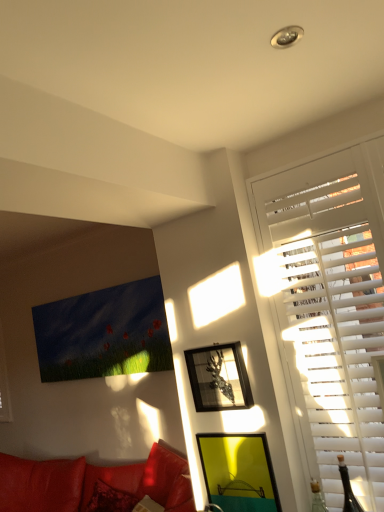
The image size is (384, 512). I want to click on yellow matte picture frame at lower center, the second picture frame when ordered from top to bottom, so click(238, 472).

Image resolution: width=384 pixels, height=512 pixels. What do you see at coordinates (92, 482) in the screenshot? I see `leather couch at lower left` at bounding box center [92, 482].

In order to face leather couch at lower left, should I rotate leftwards or rightwards?

To face it directly, rotate left by 14.970 degrees.

What is the approximate height of white wood blinds at right?

The height of white wood blinds at right is 4.57 feet.

The height and width of the screenshot is (512, 384). What do you see at coordinates (218, 378) in the screenshot?
I see `metallic silver picture frame at upper right, the first picture frame viewed from the top` at bounding box center [218, 378].

What are the coordinates of `yellow matte picture frame at lower center, the first picture frame from the bottom` in the screenshot? It's located at (238, 472).

Considering the relative positions of metallic silver picture frame at upper right, the first picture frame viewed from the top, and leather couch at lower left in the image provided, is metallic silver picture frame at upper right, the first picture frame viewed from the top, to the right of leather couch at lower left from the viewer's perspective?

Yes.

Is leather couch at lower left located within metallic silver picture frame at upper right, which is counted as the second picture frame, starting from the bottom?

No, leather couch at lower left is not a part of metallic silver picture frame at upper right, which is counted as the second picture frame, starting from the bottom.

Which is behind, metallic silver picture frame at upper right, which is counted as the second picture frame, starting from the bottom, or leather couch at lower left?

leather couch at lower left.

Is point (239, 351) closer or farther from the camera than point (209, 479)?

Point (239, 351).

Is metallic silver picture frame at upper right, the first picture frame viewed from the top, not inside yellow matte picture frame at lower center, the first picture frame from the bottom?

That's correct, metallic silver picture frame at upper right, the first picture frame viewed from the top, is outside of yellow matte picture frame at lower center, the first picture frame from the bottom.

Are metallic silver picture frame at upper right, the first picture frame viewed from the top, and yellow matte picture frame at lower center, the second picture frame when ordered from top to bottom, beside each other?

They are not placed beside each other.

Could you tell me if metallic silver picture frame at upper right, the first picture frame viewed from the top, is facing yellow matte picture frame at lower center, the first picture frame from the bottom?

No, metallic silver picture frame at upper right, the first picture frame viewed from the top, is not aimed at yellow matte picture frame at lower center, the first picture frame from the bottom.

Which is further, (207, 493) or (225, 366)?

The point (207, 493) is farther from the camera.

Can you tell me how much yellow matte picture frame at lower center, the first picture frame from the bottom, and metallic silver picture frame at upper right, which is counted as the second picture frame, starting from the bottom, differ in facing direction?

yellow matte picture frame at lower center, the first picture frame from the bottom, and metallic silver picture frame at upper right, which is counted as the second picture frame, starting from the bottom, are facing 0.00484 degrees away from each other.

Would you say yellow matte picture frame at lower center, the second picture frame when ordered from top to bottom, is to the left or to the right of metallic silver picture frame at upper right, the first picture frame viewed from the top, in the picture?

In the image, yellow matte picture frame at lower center, the second picture frame when ordered from top to bottom, appears on the right side of metallic silver picture frame at upper right, the first picture frame viewed from the top.

Who is shorter, yellow matte picture frame at lower center, the second picture frame when ordered from top to bottom, or metallic silver picture frame at upper right, which is counted as the second picture frame, starting from the bottom?

metallic silver picture frame at upper right, which is counted as the second picture frame, starting from the bottom.

Is leather couch at lower left turned away from metallic silver picture frame at upper right, the first picture frame viewed from the top?

leather couch at lower left is not turned away from metallic silver picture frame at upper right, the first picture frame viewed from the top.

Based on their positions, is leather couch at lower left located to the left or right of metallic silver picture frame at upper right, which is counted as the second picture frame, starting from the bottom?

Based on their positions, leather couch at lower left is located to the left of metallic silver picture frame at upper right, which is counted as the second picture frame, starting from the bottom.

Image resolution: width=384 pixels, height=512 pixels. What are the coordinates of `picture frame that is the 2nd one when counting upward from the leather couch at lower left (from the image's perspective)` in the screenshot? It's located at (218, 378).

Considering the relative positions of leather couch at lower left and metallic silver picture frame at upper right, which is counted as the second picture frame, starting from the bottom, in the image provided, is leather couch at lower left in front of metallic silver picture frame at upper right, which is counted as the second picture frame, starting from the bottom,?

No.

From a real-world perspective, is yellow matte picture frame at lower center, the second picture frame when ordered from top to bottom, on top of white wood blinds at right?

Actually, yellow matte picture frame at lower center, the second picture frame when ordered from top to bottom, is physically below white wood blinds at right in the real world.

Locate an element on the screen. The image size is (384, 512). the 1st picture frame to the left of the white wood blinds at right, starting your count from the anchor is located at coordinates (238, 472).

Considering the sizes of objects yellow matte picture frame at lower center, the second picture frame when ordered from top to bottom, and white wood blinds at right in the image provided, who is thinner, yellow matte picture frame at lower center, the second picture frame when ordered from top to bottom, or white wood blinds at right?

yellow matte picture frame at lower center, the second picture frame when ordered from top to bottom, is thinner.

Is metallic silver picture frame at upper right, which is counted as the second picture frame, starting from the bottom, looking in the opposite direction of white wood blinds at right?

That's not correct — metallic silver picture frame at upper right, which is counted as the second picture frame, starting from the bottom, is not looking away from white wood blinds at right.

From a real-world perspective, is metallic silver picture frame at upper right, the first picture frame viewed from the top, physically above white wood blinds at right?

No, from a real-world perspective, metallic silver picture frame at upper right, the first picture frame viewed from the top, is not on top of white wood blinds at right.

Between metallic silver picture frame at upper right, which is counted as the second picture frame, starting from the bottom, and white wood blinds at right, which one has smaller size?

With smaller size is metallic silver picture frame at upper right, which is counted as the second picture frame, starting from the bottom.

How distant is metallic silver picture frame at upper right, the first picture frame viewed from the top, from white wood blinds at right?

metallic silver picture frame at upper right, the first picture frame viewed from the top, is 15.25 inches from white wood blinds at right.

From a real-world perspective, which object rests below the other?

From a 3D spatial view, leather couch at lower left is below.

Is leather couch at lower left inside the boundaries of yellow matte picture frame at lower center, the second picture frame when ordered from top to bottom, or outside?

leather couch at lower left is not enclosed by yellow matte picture frame at lower center, the second picture frame when ordered from top to bottom.

Is there a large distance between leather couch at lower left and yellow matte picture frame at lower center, the first picture frame from the bottom?

Yes.

I want to click on studio couch on the left of metallic silver picture frame at upper right, which is counted as the second picture frame, starting from the bottom, so click(x=92, y=482).

Image resolution: width=384 pixels, height=512 pixels. What are the coordinates of `picture frame above the yellow matte picture frame at lower center, the first picture frame from the bottom (from a real-world perspective)` in the screenshot? It's located at (218, 378).

Estimate the real-world distances between objects in this image. Which object is closer to metallic silver picture frame at upper right, the first picture frame viewed from the top, yellow matte picture frame at lower center, the second picture frame when ordered from top to bottom, or white wood blinds at right?

Based on the image, yellow matte picture frame at lower center, the second picture frame when ordered from top to bottom, appears to be nearer to metallic silver picture frame at upper right, the first picture frame viewed from the top.

When comparing their distances from yellow matte picture frame at lower center, the first picture frame from the bottom, does white wood blinds at right or leather couch at lower left seem closer?

Based on the image, white wood blinds at right appears to be nearer to yellow matte picture frame at lower center, the first picture frame from the bottom.

Considering their positions, is white wood blinds at right positioned closer to metallic silver picture frame at upper right, the first picture frame viewed from the top, than yellow matte picture frame at lower center, the first picture frame from the bottom?

yellow matte picture frame at lower center, the first picture frame from the bottom, is closer to metallic silver picture frame at upper right, the first picture frame viewed from the top.

When comparing their distances from white wood blinds at right, does yellow matte picture frame at lower center, the second picture frame when ordered from top to bottom, or leather couch at lower left seem further?

Among the two, leather couch at lower left is located further to white wood blinds at right.

From the image, which object appears to be nearer to leather couch at lower left, yellow matte picture frame at lower center, the first picture frame from the bottom, or white wood blinds at right?

yellow matte picture frame at lower center, the first picture frame from the bottom, is positioned closer to the anchor leather couch at lower left.

Estimate the real-world distances between objects in this image. Which object is further from yellow matte picture frame at lower center, the second picture frame when ordered from top to bottom, metallic silver picture frame at upper right, which is counted as the second picture frame, starting from the bottom, or leather couch at lower left?

Based on the image, leather couch at lower left appears to be further to yellow matte picture frame at lower center, the second picture frame when ordered from top to bottom.

Considering their positions, is metallic silver picture frame at upper right, the first picture frame viewed from the top, positioned closer to white wood blinds at right than yellow matte picture frame at lower center, the second picture frame when ordered from top to bottom?

metallic silver picture frame at upper right, the first picture frame viewed from the top, is closer to white wood blinds at right.

Estimate the real-world distances between objects in this image. Which object is further from yellow matte picture frame at lower center, the second picture frame when ordered from top to bottom, leather couch at lower left or metallic silver picture frame at upper right, the first picture frame viewed from the top?

The object further to yellow matte picture frame at lower center, the second picture frame when ordered from top to bottom, is leather couch at lower left.

In order to click on picture frame between metallic silver picture frame at upper right, which is counted as the second picture frame, starting from the bottom, and leather couch at lower left vertically in this screenshot , I will do `click(238, 472)`.

Where is `picture frame that lies between white wood blinds at right and yellow matte picture frame at lower center, the first picture frame from the bottom, from top to bottom`? picture frame that lies between white wood blinds at right and yellow matte picture frame at lower center, the first picture frame from the bottom, from top to bottom is located at coordinates (218, 378).